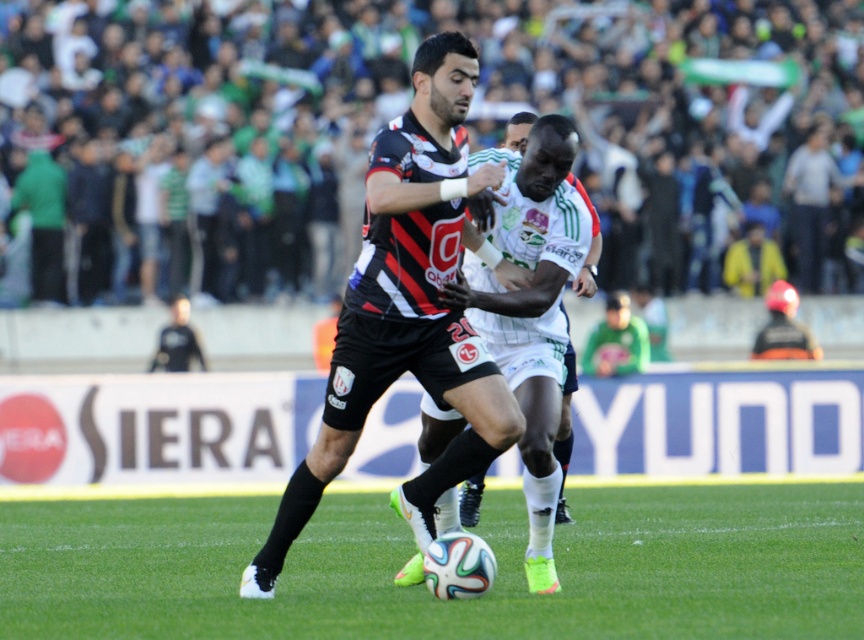
Measure the distance between green fabric crowd at upper center and camera.

green fabric crowd at upper center and camera are 9.36 meters apart.

Is green fabric crowd at upper center smaller than green grass at center?

No, green fabric crowd at upper center is not smaller than green grass at center.

This screenshot has width=864, height=640. Identify the location of green fabric crowd at upper center. (405, 108).

Which of these two, green fabric crowd at upper center or black matte soccer player at center, stands shorter?

Standing shorter between the two is black matte soccer player at center.

Is green fabric crowd at upper center to the left of black matte soccer player at center from the viewer's perspective?

Incorrect, green fabric crowd at upper center is not on the left side of black matte soccer player at center.

Is point (192, 74) farther from camera compared to point (500, 291)?

Yes.

What are the coordinates of `green fabric crowd at upper center` in the screenshot? It's located at (405, 108).

Who is more forward, (722, 531) or (548, 448)?

Positioned in front is point (548, 448).

Does green grass at center appear over black matte soccer player at center?

Actually, green grass at center is below black matte soccer player at center.

Who is more distant from viewer, (361, 579) or (538, 332)?

The point (361, 579) is more distant.

Find the location of a particular element. This screenshot has width=864, height=640. green grass at center is located at coordinates (422, 582).